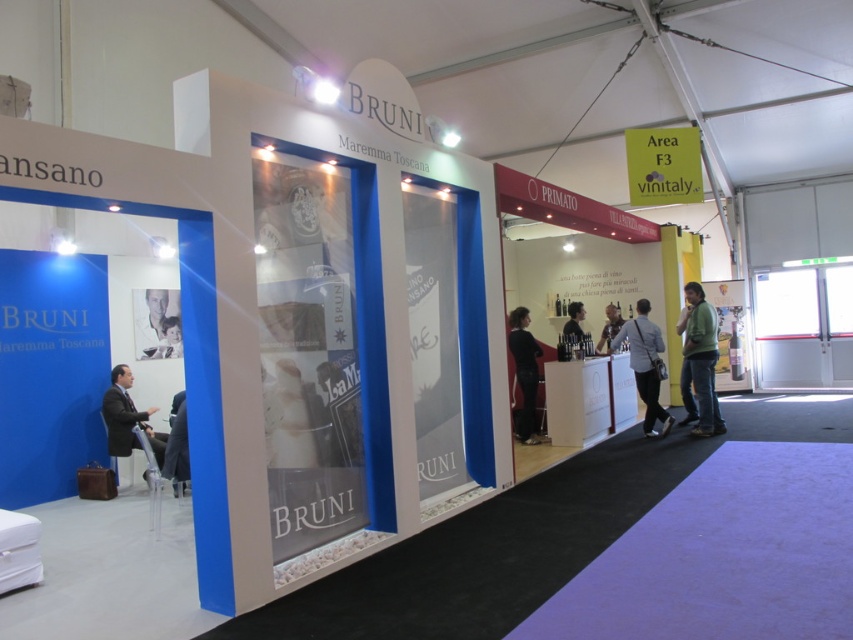
Question: Which object is positioned farthest from the dark suit at lower left?

Choices:
 (A) green matte jacket at lower right
 (B) light gray fabric jacket at center

Answer: (A)

Question: Does light gray fabric jacket at center appear on the left side of dark suit at lower left?

Choices:
 (A) yes
 (B) no

Answer: (B)

Question: Which of these objects is positioned closest to the light gray fabric jacket at center?

Choices:
 (A) matte black jacket at center
 (B) black fabric at center
 (C) dark suit at lower left
 (D) green matte jacket at lower right

Answer: (D)

Question: Does black fabric at center appear on the left side of matte black jacket at center?

Choices:
 (A) yes
 (B) no

Answer: (A)

Question: Among these objects, which one is nearest to the camera?

Choices:
 (A) light gray fabric jacket at center
 (B) dark suit at lower left
 (C) light brown leather jacket at lower left
 (D) matte black jacket at center

Answer: (B)

Question: Is green matte jacket at lower right further to the viewer compared to light brown leather jacket at center?

Choices:
 (A) no
 (B) yes

Answer: (A)